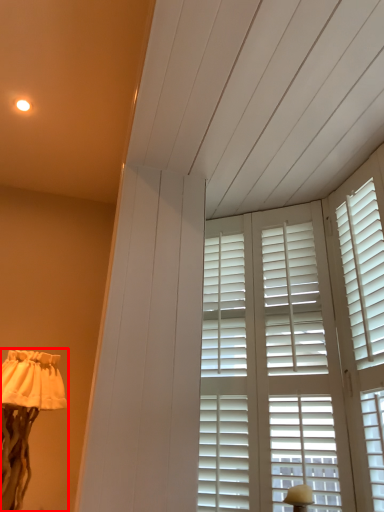
Question: Considering the relative positions of lamp (annotated by the red box) and window in the image provided, where is lamp (annotated by the red box) located with respect to the staircase?

Choices:
 (A) left
 (B) right

Answer: (A)